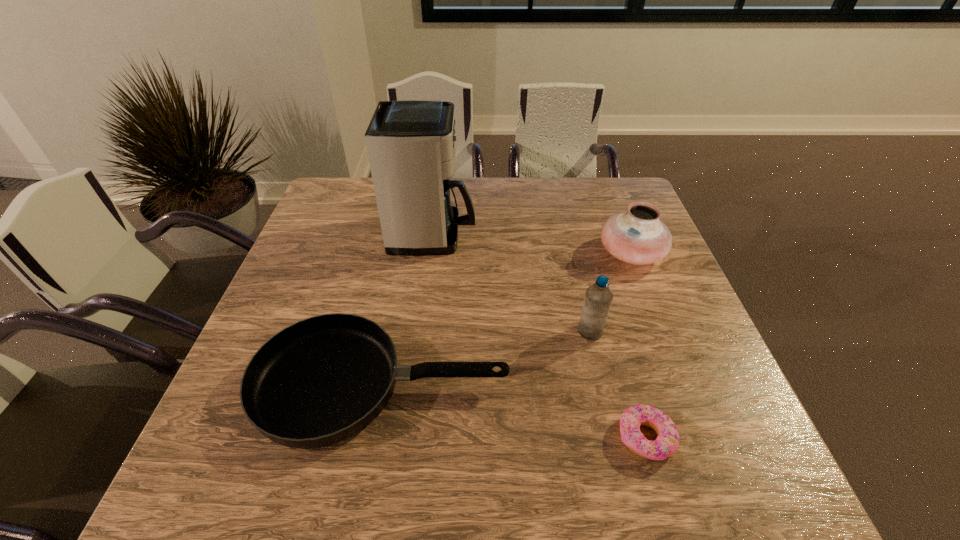
In the image, there is a desktop. Identify the location of blank space at the left edge. This screenshot has height=540, width=960. tap(319, 274).

The height and width of the screenshot is (540, 960). What are the coordinates of `free space at the right edge of the desktop` in the screenshot? It's located at (715, 375).

Locate an element on the screen. The image size is (960, 540). blank space at the far right corner is located at coordinates (610, 180).

Find the location of a particular element. empty location between the third tallest object and the doughnut is located at coordinates (638, 346).

The height and width of the screenshot is (540, 960). I want to click on vacant region between the water bottle and the shortest object, so click(x=618, y=384).

Find the location of a particular element. This screenshot has height=540, width=960. free space that is in between the doughnut and the coffee maker is located at coordinates (540, 336).

Identify the location of free space between the coffee maker and the shortest object. The height and width of the screenshot is (540, 960). (540, 336).

Identify the location of free area in between the frying pan and the water bottle. (486, 359).

Where is `unoccupied position between the fourth tallest object and the third tallest object`? The height and width of the screenshot is (540, 960). unoccupied position between the fourth tallest object and the third tallest object is located at coordinates (506, 319).

The image size is (960, 540). I want to click on the second closest object to the water bottle, so click(321, 380).